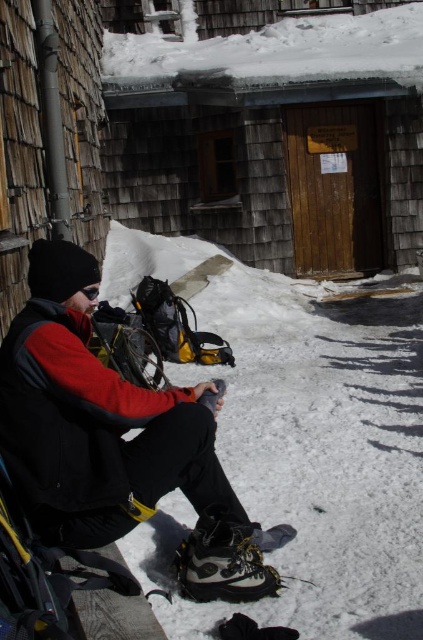
You are standing at the camera position and want to reach the point marked as point (184,435). Can you estimate how far you need to walk to get there?

The distance between the camera and point (184,435) is 7.79 feet, so you need to walk approximately 7.79 feet to reach that point.

You are standing at the edge of the snowy area and want to reach the wooden cabin at center. Which direction should you walk to get there?

The wooden cabin at center is located at coordinates 0.212 on the x axis and 0.650 on the y axis, so you should walk towards the center of the image where the wooden cabin at center is situated.

You are standing in the snowy outdoor scene and want to know which of the two points, point (390, 104) or point (216, 540), is closer to you. Based on the image, which point is nearer?

Point (216, 540) is closer to you because it is less far away than point (390, 104), which is further away from the camera.